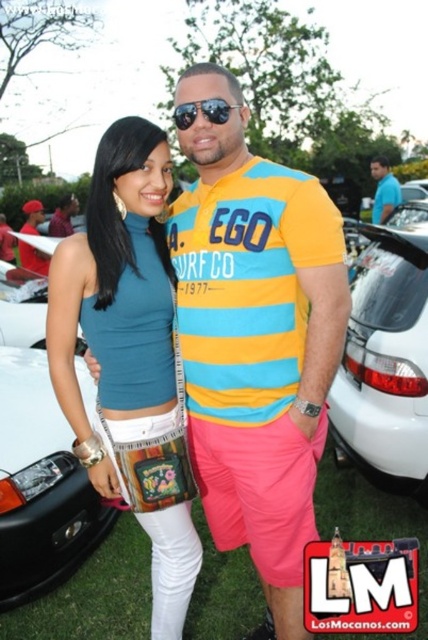
Question: Which object is positioned closest to the white matte car at lower left?

Choices:
 (A) matte striped t-shirt at center
 (B) white matte car at right
 (C) blue cotton shirt at upper right

Answer: (A)

Question: Does matte striped t-shirt at center have a lesser width compared to white matte car at right?

Choices:
 (A) yes
 (B) no

Answer: (B)

Question: From the image, what is the correct spatial relationship of white matte car at right in relation to sunglasses at center?

Choices:
 (A) below
 (B) above

Answer: (A)

Question: Estimate the real-world distances between objects in this image. Which object is farther from the matte black shirt at center?

Choices:
 (A) teal matte tank top at center
 (B) matte striped t-shirt at center
 (C) sunglasses at center
 (D) white matte car at right

Answer: (B)

Question: Does teal matte tank top at center appear on the right side of sunglasses at center?

Choices:
 (A) yes
 (B) no

Answer: (B)

Question: Which is farther from the sunglasses at center?

Choices:
 (A) matte black shirt at center
 (B) white matte car at lower left
 (C) blue cotton shirt at upper right

Answer: (C)